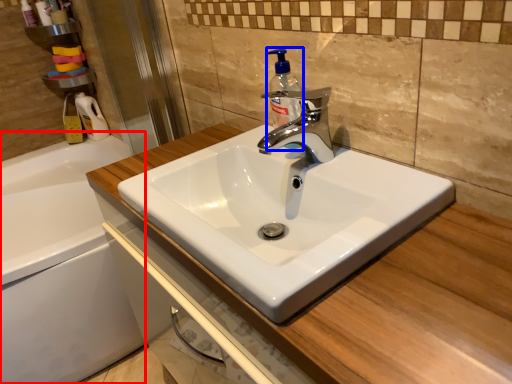
Question: Which point is further to the camera, bath (highlighted by a red box) or soap dispenser (highlighted by a blue box)?

Choices:
 (A) bath
 (B) soap dispenser

Answer: (A)